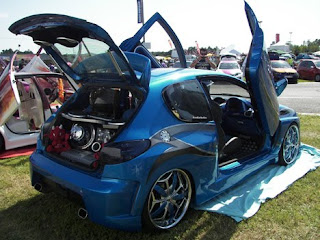
Image resolution: width=320 pixels, height=240 pixels. I want to click on back window, so [x=93, y=63].